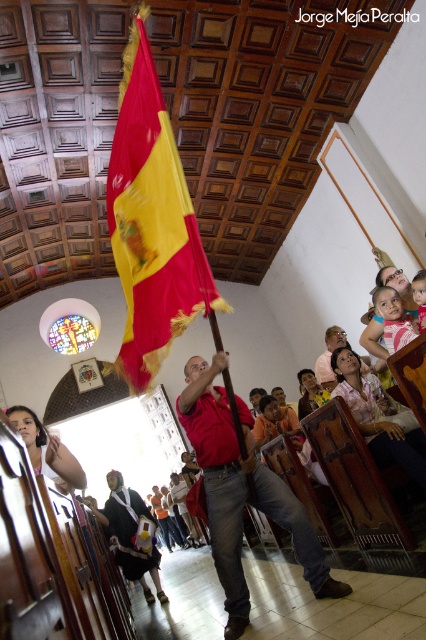
Which is behind, point (195, 369) or point (141, 550)?

The point (141, 550) is more distant.

Based on the photo, between matte red shirt at center and white fabric dress at center, which one is positioned lower?

white fabric dress at center is lower down.

Find the location of a particular element. Image resolution: width=426 pixels, height=640 pixels. matte red shirt at center is located at coordinates (241, 492).

The image size is (426, 640). What do you see at coordinates (152, 221) in the screenshot?
I see `red/yellow fabric flag at center` at bounding box center [152, 221].

Is red/yellow fabric flag at center smaller than matte red shirt at center?

Yes.

Between point (196, 227) and point (221, 476), which one is positioned in front?

Point (221, 476) is in front.

The height and width of the screenshot is (640, 426). What are the coordinates of `red/yellow fabric flag at center` in the screenshot? It's located at (152, 221).

Between red/yellow fabric flag at center and white fabric dress at center, which one has less height?

white fabric dress at center

Between point (181, 205) and point (100, 518), which one is positioned behind?

The point (100, 518) is more distant.

Where is `red/yellow fabric flag at center`? red/yellow fabric flag at center is located at coordinates (152, 221).